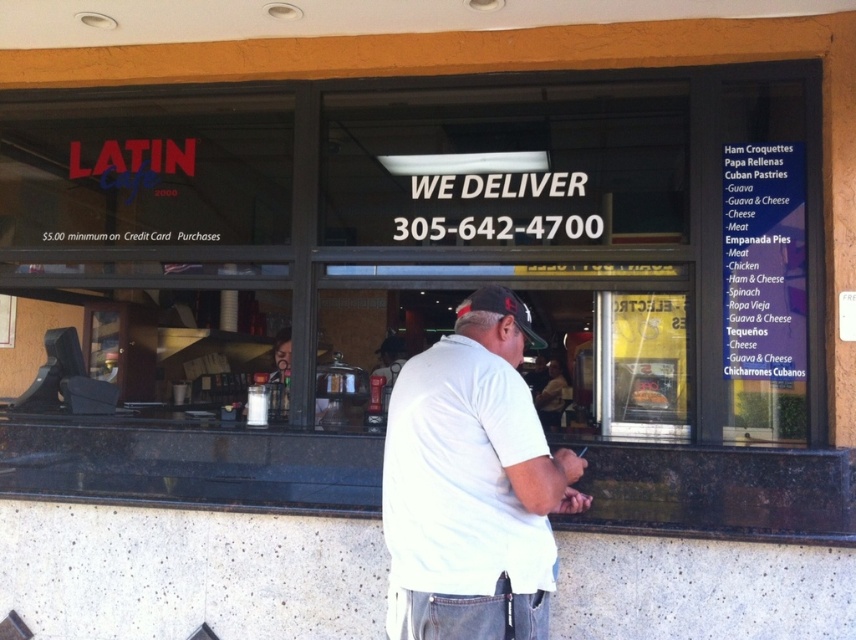
You are a customer waiting outside the Latin Cafe 2000 and notice two items displayed in the window. You see a white cotton shirt at center and a black fabric baseball cap at center. Which item is located to the left when viewed from the outside?

The white cotton shirt at center is positioned on the left side of the black fabric baseball cap at center, so it is located to the left when viewed from the outside.

You are a customer standing outside the Latin Cafe 2000 and want to see both the white cotton shirt at center and the black fabric baseball cap at center displayed in the window. Which one do you see first when looking through the window?

The white cotton shirt at center is in front of the black fabric baseball cap at center, so you see the white cotton shirt at center first when looking through the window.

You are standing outside the Latin Cafe 2000 and want to know which of the two points, point (515, 420) or point (495, 289), is closer to you. Based on the scene, which point is nearer?

Point (515, 420) is in front of point (495, 289), so it is closer to you.